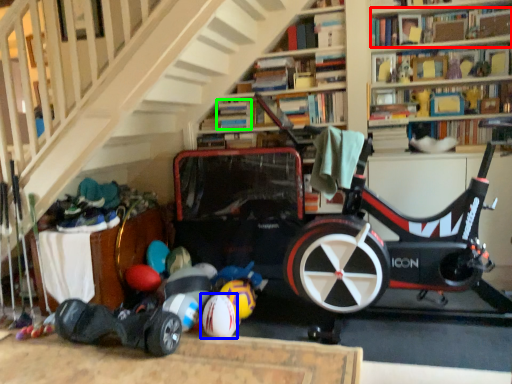
Question: Estimate the real-world distances between objects in this image. Which object is farther from book (highlighted by a red box), ball (highlighted by a blue box) or book (highlighted by a green box)?

Choices:
 (A) ball
 (B) book

Answer: (A)